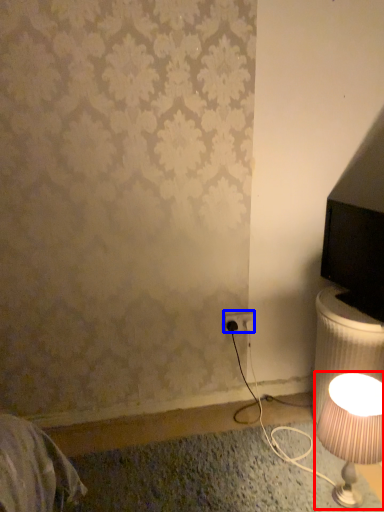
Question: Which object appears closest to the camera in this image, lamp (highlighted by a red box) or electric outlet (highlighted by a blue box)?

Choices:
 (A) lamp
 (B) electric outlet

Answer: (A)